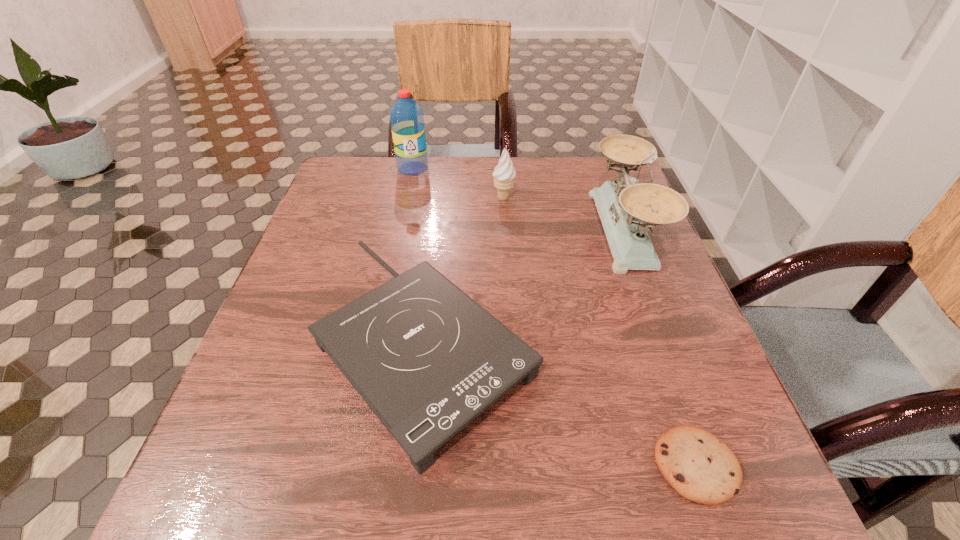
Identify the location of the farthest object. Image resolution: width=960 pixels, height=540 pixels. (406, 116).

Locate an element on the screen. The height and width of the screenshot is (540, 960). scale is located at coordinates (627, 211).

In order to click on icecream in this screenshot , I will do `click(504, 173)`.

Image resolution: width=960 pixels, height=540 pixels. I want to click on hotplate, so click(427, 359).

This screenshot has width=960, height=540. I want to click on cookie, so click(x=701, y=468).

This screenshot has height=540, width=960. Find the location of `vacant space located on the front label of the farthest object`. vacant space located on the front label of the farthest object is located at coordinates (391, 272).

Find the location of a particular element. Image resolution: width=960 pixels, height=540 pixels. free space located on the front-facing side of the scale is located at coordinates (x=538, y=231).

Locate an element on the screen. The width and height of the screenshot is (960, 540). vacant space situated on the front-facing side of the scale is located at coordinates (492, 231).

Locate an element on the screen. free space located 0.390m on the front-facing side of the scale is located at coordinates (433, 231).

I want to click on vacant space located 0.060m on the front-facing side of the third tallest object, so click(468, 198).